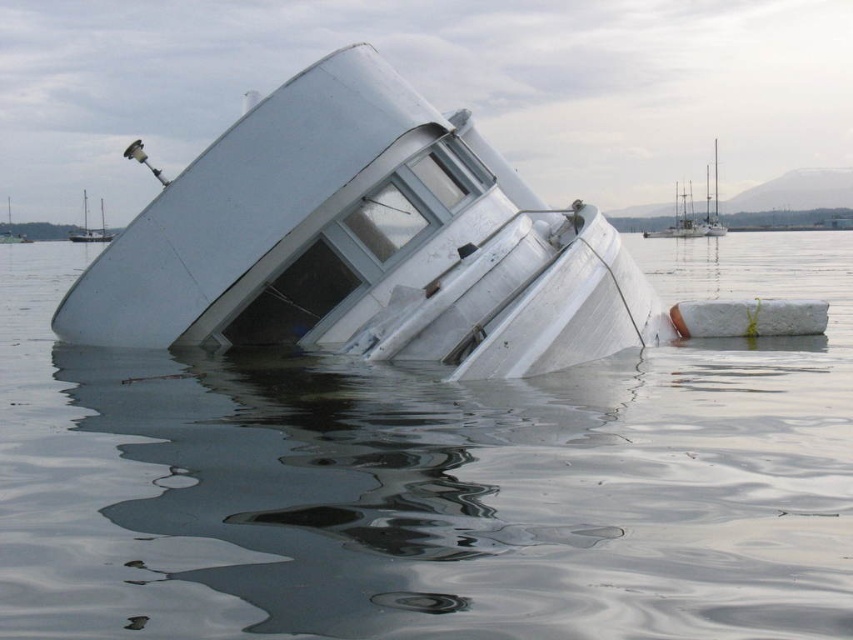
Question: Which of the following is the farthest from the observer?

Choices:
 (A) white glossy boat at center
 (B) white matte boat at upper center

Answer: (A)

Question: Is transparent water at center in front of white matte boat at upper center?

Choices:
 (A) yes
 (B) no

Answer: (A)

Question: Which object is positioned farthest from the white glossy boat at center?

Choices:
 (A) transparent water at center
 (B) white matte boat at center

Answer: (B)

Question: Is transparent water at center to the right of white glossy boat at center from the viewer's perspective?

Choices:
 (A) no
 (B) yes

Answer: (B)

Question: Is white matte boat at center above white glossy boat at center?

Choices:
 (A) no
 (B) yes

Answer: (A)

Question: Which point is farther to the camera?

Choices:
 (A) (68, 237)
 (B) (19, 240)
 (C) (527, 337)

Answer: (B)